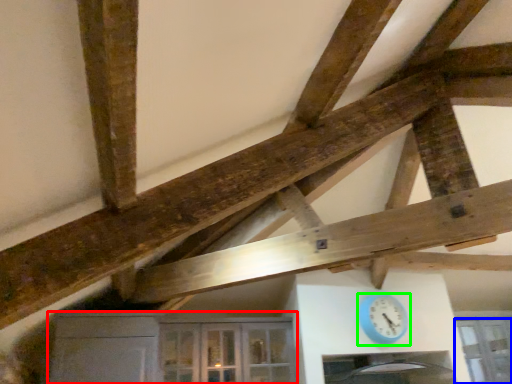
Question: Which is nearer to the cabinetry (highlighted by a red box)? window (highlighted by a blue box) or clock (highlighted by a green box).

Choices:
 (A) window
 (B) clock

Answer: (B)